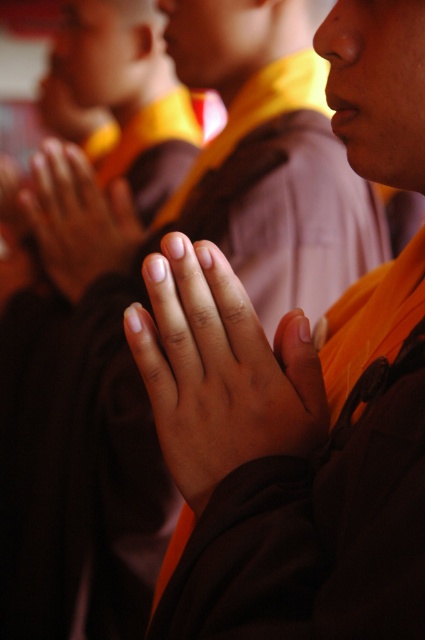
Does smooth skin hands at center appear on the left side of matte orange cloth at center?

In fact, smooth skin hands at center is to the right of matte orange cloth at center.

Who is taller, smooth skin hands at center or matte orange cloth at center?

With more height is matte orange cloth at center.

Where is `smooth skin hands at center`? This screenshot has height=640, width=425. smooth skin hands at center is located at coordinates (221, 371).